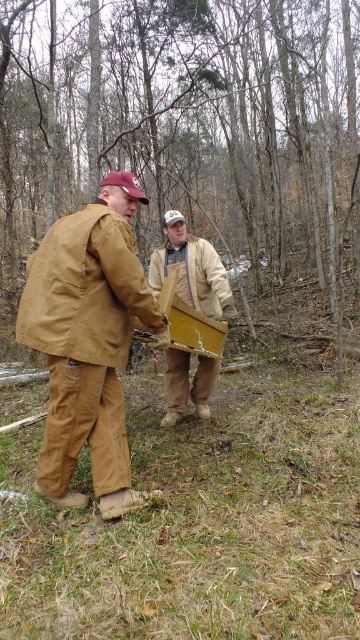
Based on the provided scene, where exactly is the brown wood tree at center located in terms of coordinates?

The brown wood tree at center is located at point coordinates of (187,124).

You are a hiker who needs to place a marker exactly halfway between the brown wood tree at center and the wooden crate at center. According to the scene, which object will the marker be closer to?

The marker will be closer to the wooden crate at center because the brown wood tree at center is to the right of the wooden crate at center, meaning the crate is positioned to the left of the tree. Therefore, the midpoint between them would be closer to the crate.